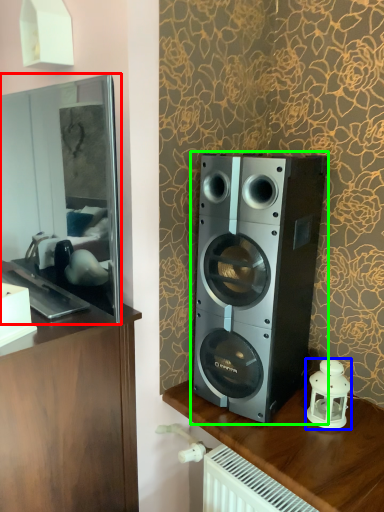
Question: Estimate the real-world distances between objects in this image. Which object is farther from mirror (highlighted by a red box), candle holder (highlighted by a blue box) or home appliance (highlighted by a green box)?

Choices:
 (A) candle holder
 (B) home appliance

Answer: (A)